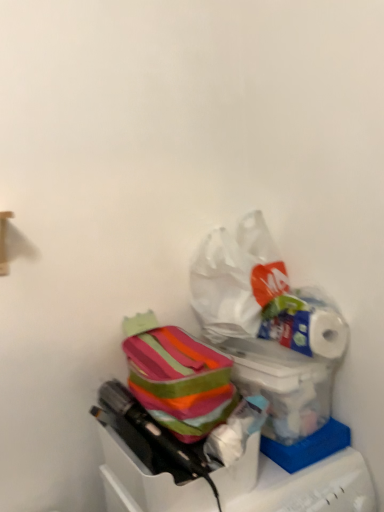
Identify the location of vacant space to the left of white glossy toilet paper at upper right. Image resolution: width=384 pixels, height=512 pixels. (263, 353).